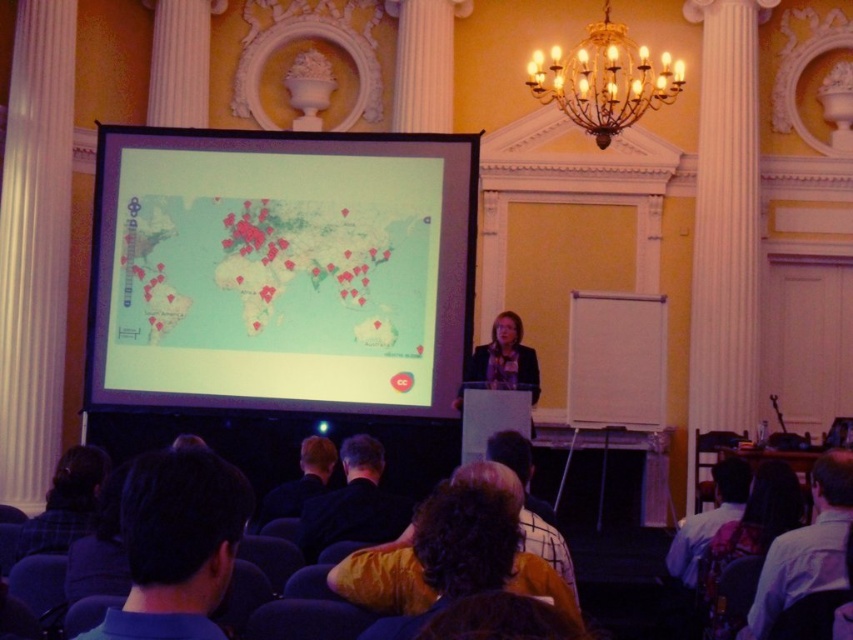
You are attending a presentation in the grand hall. You see the black fabric shirt at lower center and the light blue shirt at lower right. Which one has a narrower width?

The black fabric shirt at lower center is thinner than the light blue shirt at lower right, so the black fabric shirt at lower center has a narrower width.

You are a guest sitting at the back of the grand hall and want to see the projection screen. There are two points marked on the floor in front of you. The first point is at coordinate point (x=809, y=563) and the second is at coordinate point (x=326, y=445). Which point should you stand on to have an unobstructed view of the projection screen?

You should stand on point (x=809, y=563) because it is in front of point (x=326, y=445), providing a clearer line of sight to the projection screen.